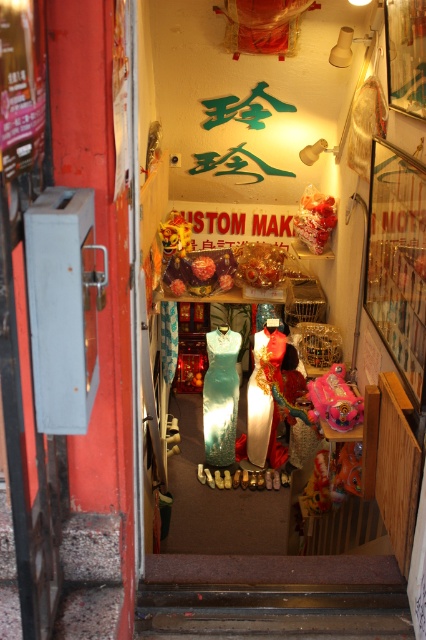
Can you confirm if shiny pink toy at center is smaller than shiny gold lion at center?

Yes.

This screenshot has height=640, width=426. I want to click on shiny pink toy at center, so click(x=336, y=400).

Between point (342, 381) and point (187, 241), which one is positioned behind?

Positioned behind is point (187, 241).

Find the location of a particular element. The width and height of the screenshot is (426, 640). shiny pink toy at center is located at coordinates pos(336,400).

Can you confirm if shiny green dress at center is thinner than matte green dress at center?

Yes.

Who is more forward, (230, 371) or (270, 445)?

Point (230, 371)

The height and width of the screenshot is (640, 426). I want to click on shiny green dress at center, so click(221, 396).

Can you confirm if shiny green dress at center is positioned below shiny pink toy at center?

Correct, shiny green dress at center is located below shiny pink toy at center.

Which is more to the right, shiny green dress at center or shiny pink toy at center?

shiny pink toy at center

Locate an element on the screen. Image resolution: width=426 pixels, height=640 pixels. shiny green dress at center is located at coordinates (221, 396).